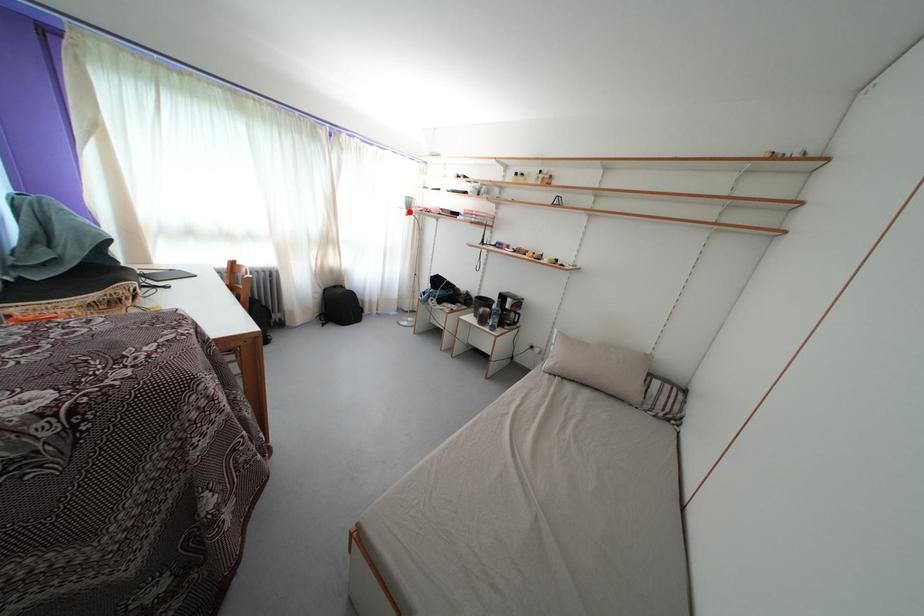
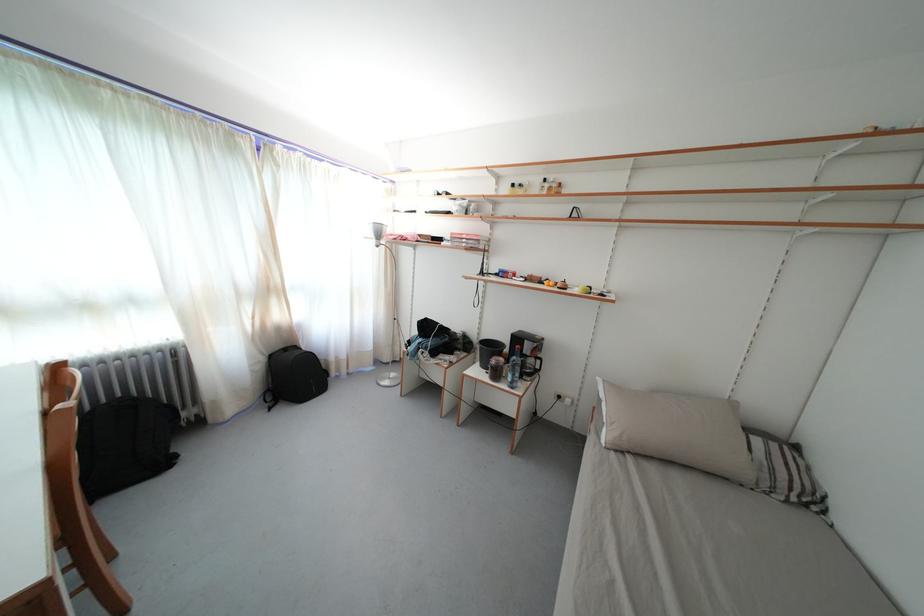
Question: A red point is marked in image1. In image2, is the corresponding 3D point closer to the camera or farther? Reply with the corresponding letter.

Choices:
 (A) The corresponding 3D point is closer.
 (B) The corresponding 3D point is farther.

Answer: (B)